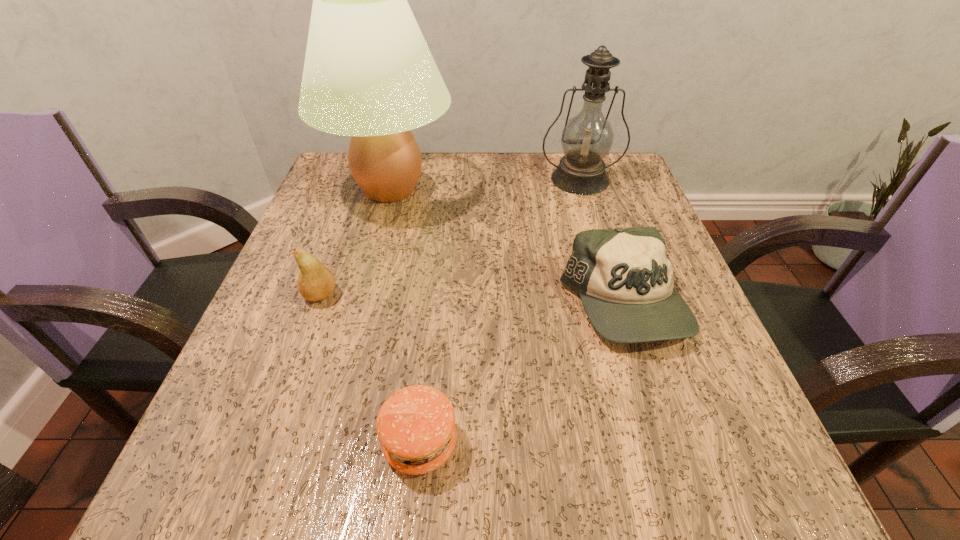
The height and width of the screenshot is (540, 960). What are the coordinates of `free space located 0.360m on the back of the nearest object` in the screenshot? It's located at (441, 245).

You are a GUI agent. You are given a task and a screenshot of the screen. Output one action in this format:
    pyautogui.click(x=<x>, y=<y>)
    Task: Click on the lampshade at the far edge
    The width and height of the screenshot is (960, 540).
    Given the screenshot: What is the action you would take?
    (368, 73)

Locate an element on the screen. oil lamp located at the far edge is located at coordinates (587, 138).

Find the location of a particular element. object present at the near edge is located at coordinates (416, 427).

The image size is (960, 540). Identify the location of lampshade that is at the left edge. [x=368, y=73].

Where is `pear that is at the left edge`? The image size is (960, 540). pear that is at the left edge is located at coordinates (315, 282).

Locate an element on the screen. This screenshot has height=540, width=960. oil lamp located at the right edge is located at coordinates (587, 138).

This screenshot has width=960, height=540. In order to click on baseball cap located in the right edge section of the desktop in this screenshot , I will do `click(624, 278)`.

You are a GUI agent. You are given a task and a screenshot of the screen. Output one action in this format:
    pyautogui.click(x=<x>, y=<y>)
    Task: Click on the object present at the far left corner
    This screenshot has height=540, width=960.
    Given the screenshot: What is the action you would take?
    pyautogui.click(x=368, y=73)

The width and height of the screenshot is (960, 540). I want to click on object that is at the far right corner, so click(x=587, y=138).